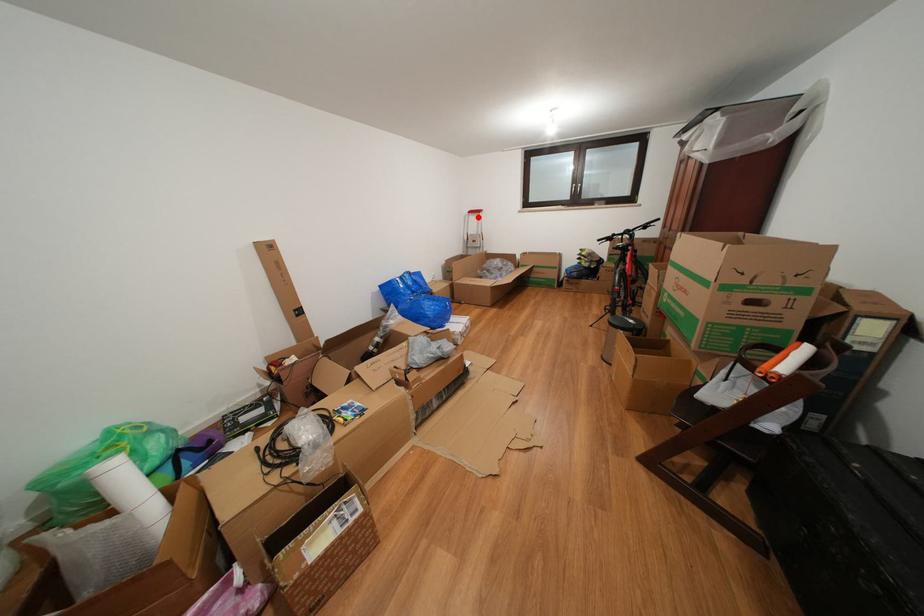
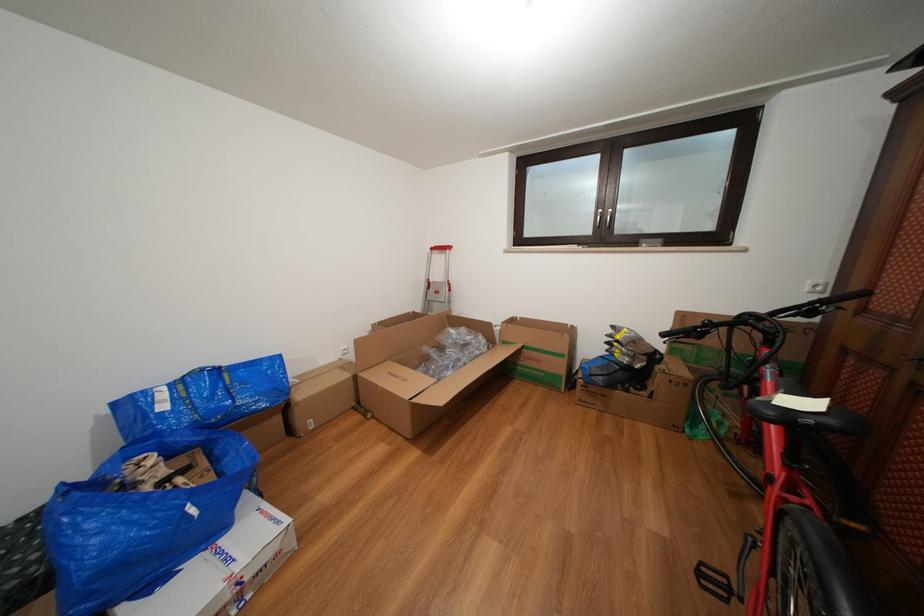
In the second image, find the point that corresponds to the highlighted location in the first image.

(441, 254)